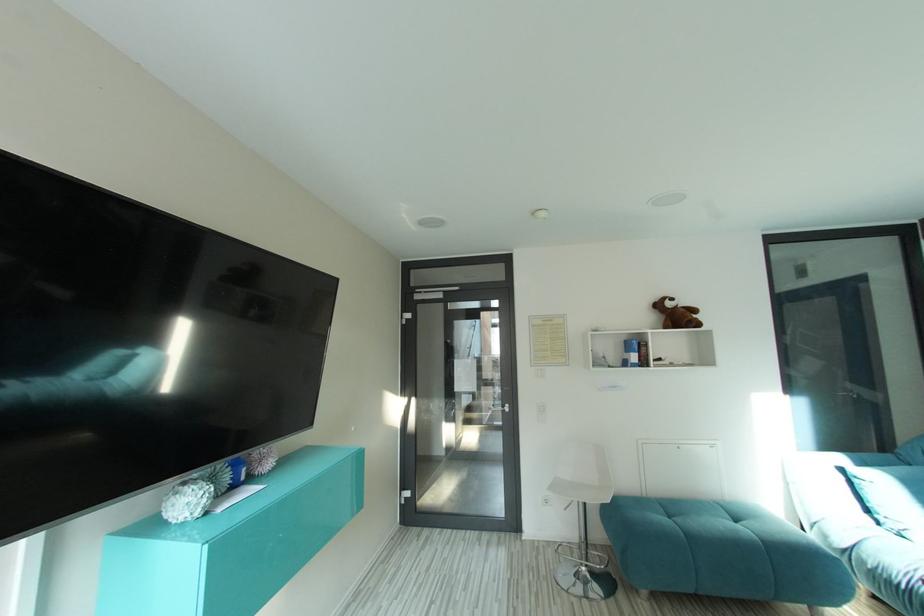
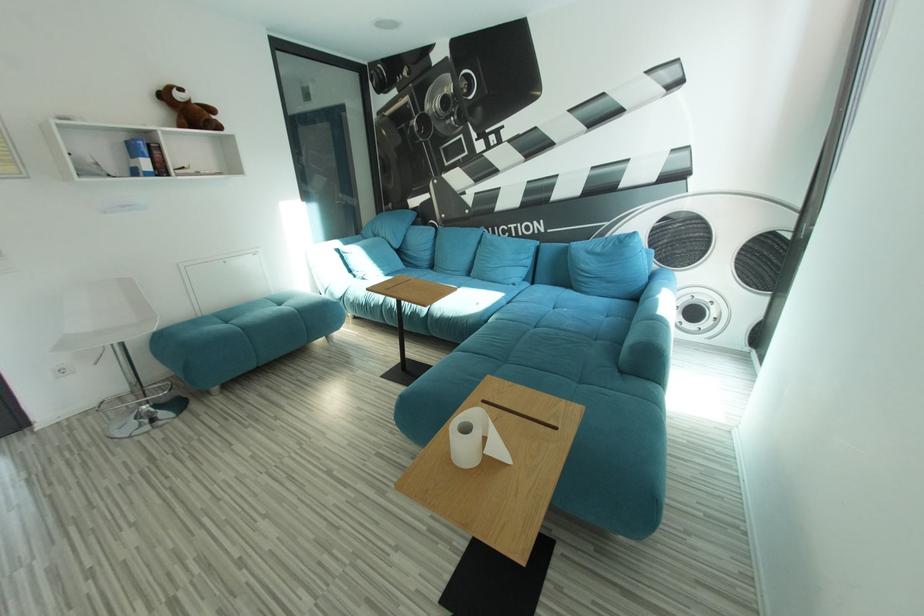
First-person continuous shooting, in which direction is the camera rotating?

The camera rotated toward right-down.